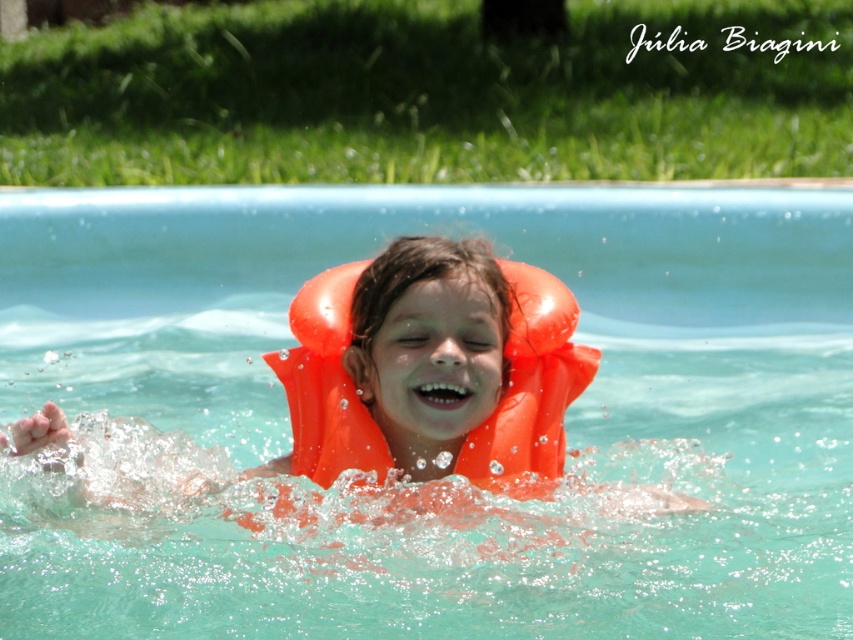
Question: Which object appears closest to the camera in this image?

Choices:
 (A) transparent plastic pool at center
 (B) orange rubber life jacket at center

Answer: (B)

Question: Among these points, which one is farthest from the camera?

Choices:
 (A) (325, 481)
 (B) (582, 310)

Answer: (B)

Question: Is transparent plastic pool at center wider than orange rubber life jacket at center?

Choices:
 (A) yes
 (B) no

Answer: (A)

Question: Can you confirm if transparent plastic pool at center is wider than orange rubber life jacket at center?

Choices:
 (A) yes
 (B) no

Answer: (A)

Question: Can you confirm if transparent plastic pool at center is positioned to the left of orange rubber life jacket at center?

Choices:
 (A) yes
 (B) no

Answer: (A)

Question: Which point is farther to the camera?

Choices:
 (A) coord(16,369)
 (B) coord(517,310)

Answer: (A)